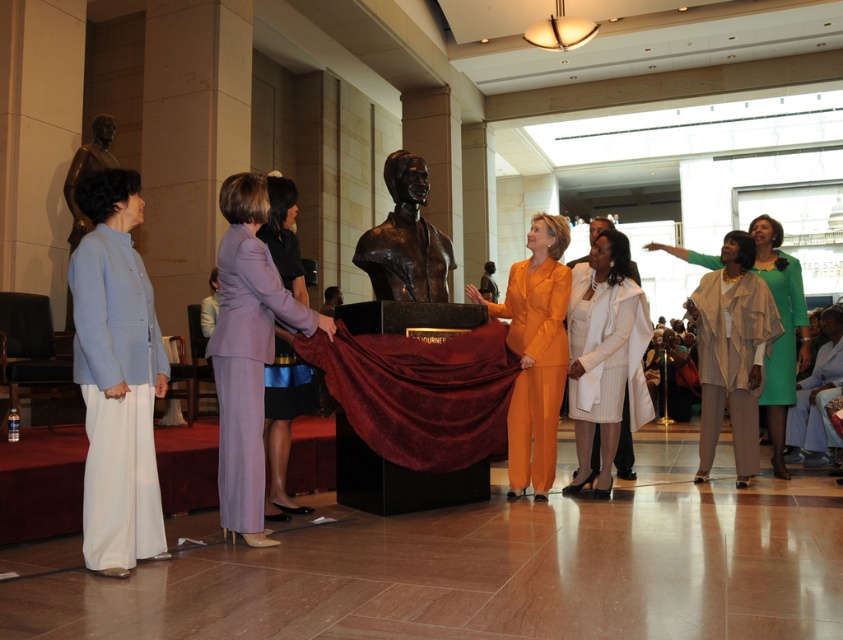
Question: Considering the real-world distances, which object is closest to the bronze bust at center?

Choices:
 (A) light blue fabric coat at left
 (B) purple fabric skirt at center

Answer: (B)

Question: Does beige textured coat at right appear under purple fabric skirt at center?

Choices:
 (A) no
 (B) yes

Answer: (B)

Question: Does orange matte suit at center appear under white pinstripe coat at center?

Choices:
 (A) yes
 (B) no

Answer: (B)

Question: Does orange matte suit at center appear on the left side of beige textured coat at right?

Choices:
 (A) yes
 (B) no

Answer: (A)

Question: Which of the following is the closest to the observer?

Choices:
 (A) (272, 275)
 (B) (777, 317)
 (C) (261, 234)
 (D) (521, 280)

Answer: (A)

Question: Which point is closer to the camera taking this photo?

Choices:
 (A) (406, 264)
 (B) (742, 474)

Answer: (A)